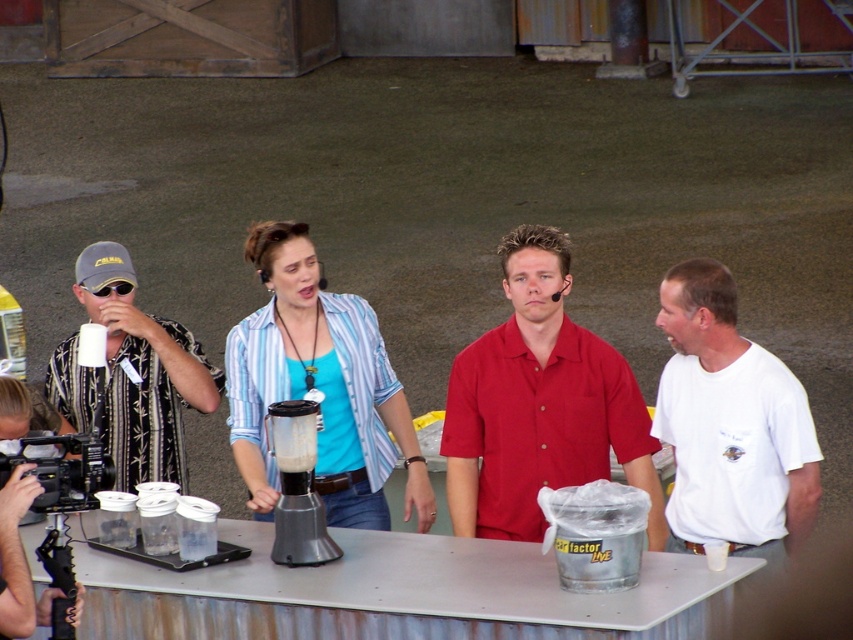
Question: Which point is closer to the camera taking this photo?

Choices:
 (A) (671, 284)
 (B) (96, 428)
 (C) (189, 362)

Answer: (A)

Question: Can you confirm if metallic gray table at center is wider than blue striped shirt at center?

Choices:
 (A) yes
 (B) no

Answer: (A)

Question: Can you confirm if metallic gray table at center is positioned to the left of blue striped shirt at center?

Choices:
 (A) no
 (B) yes

Answer: (A)

Question: Which point appears farthest from the camera in this image?

Choices:
 (A) (666, 429)
 (B) (108, 486)
 (C) (91, 314)
 (D) (392, 566)

Answer: (C)

Question: Which point is closer to the camera taking this photo?

Choices:
 (A) (440, 618)
 (B) (74, 476)
 (C) (277, 419)

Answer: (A)

Question: Does metallic gray table at center appear on the left side of red matte shirt at center?

Choices:
 (A) yes
 (B) no

Answer: (A)